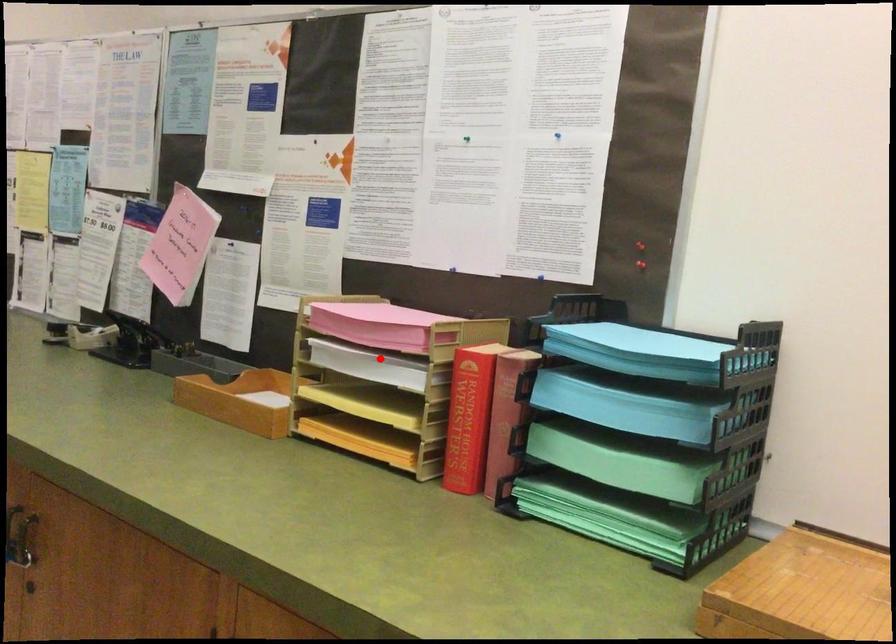
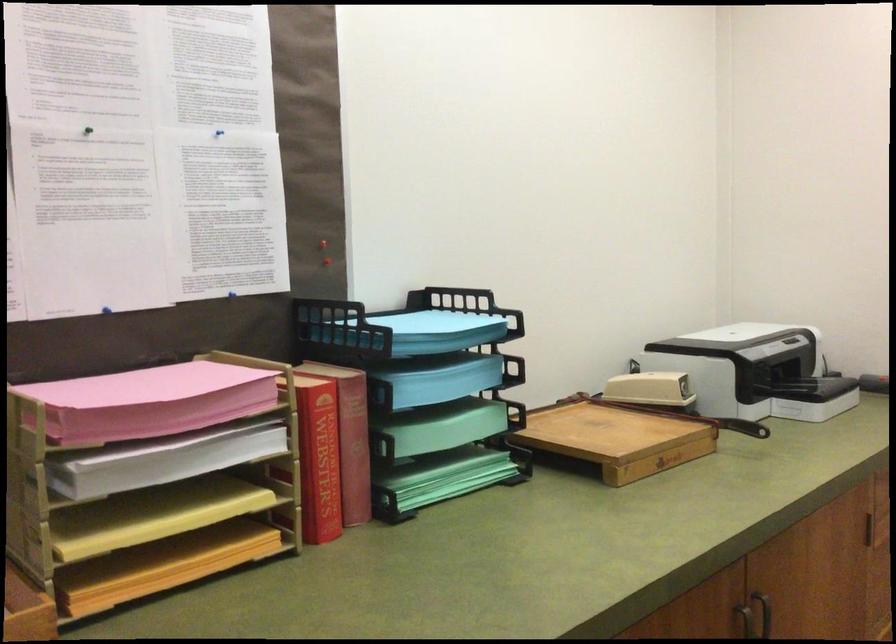
Question: I am providing you with two images of the same scene from different viewpoints. Image1 has a red point marked. In image2, the corresponding 3D location appears at what relative position? Reply with the corresponding letter.

Choices:
 (A) Closer
 (B) Farther

Answer: (A)